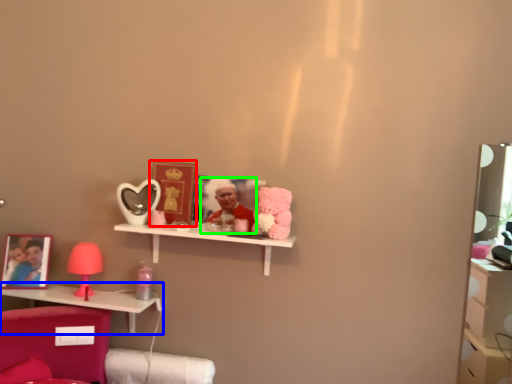
Question: Estimate the real-world distances between objects in this image. Which object is farther from picture frame (highlighted by a red box), shelf (highlighted by a blue box) or person (highlighted by a green box)?

Choices:
 (A) shelf
 (B) person

Answer: (A)